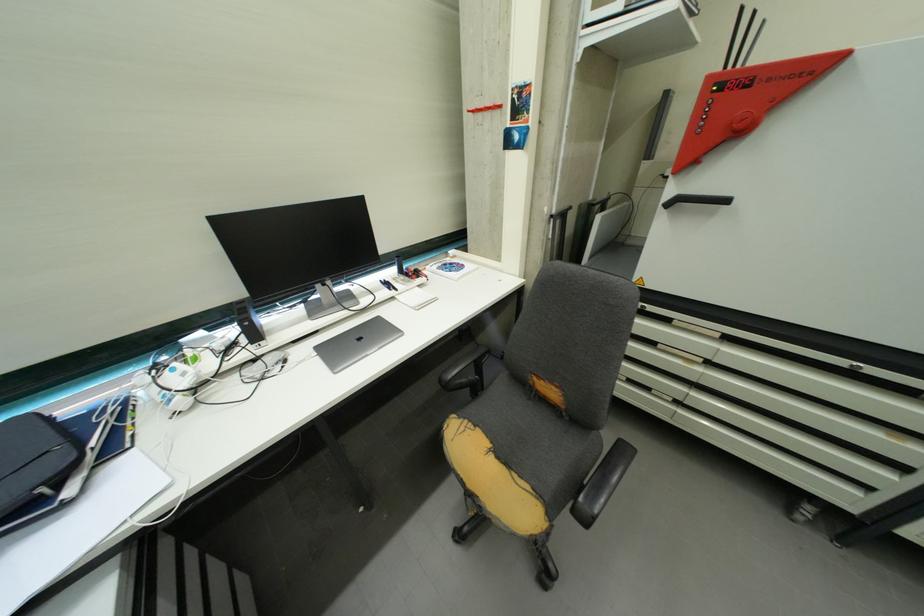
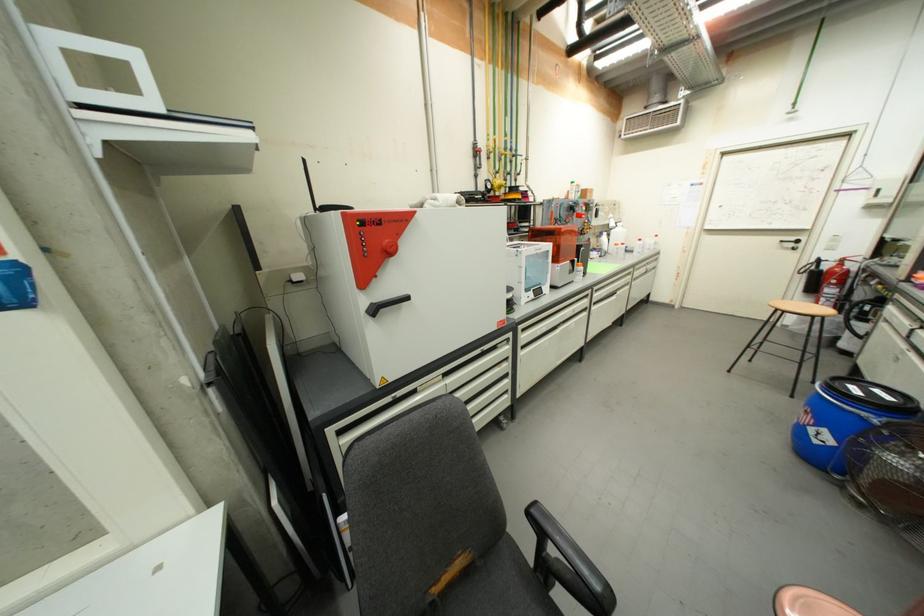
Question: The images are taken continuously from a first-person perspective. In which direction is your viewpoint rotating?

Choices:
 (A) Left
 (B) Right
 (C) Up
 (D) Down

Answer: (B)